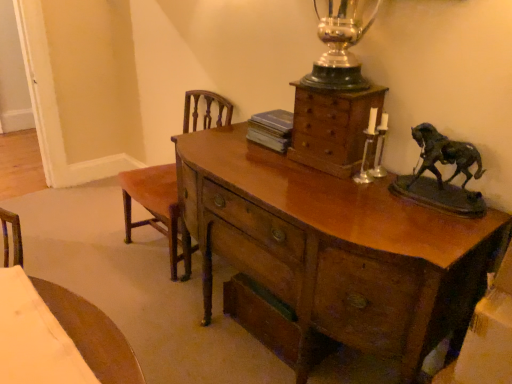
At what (x,y) coordinates should I click in order to perform the action: click on free space in front of brown wood chair at left. Please return your answer as a coordinate pair (x, y). The image size is (512, 384). Looking at the image, I should click on (146, 307).